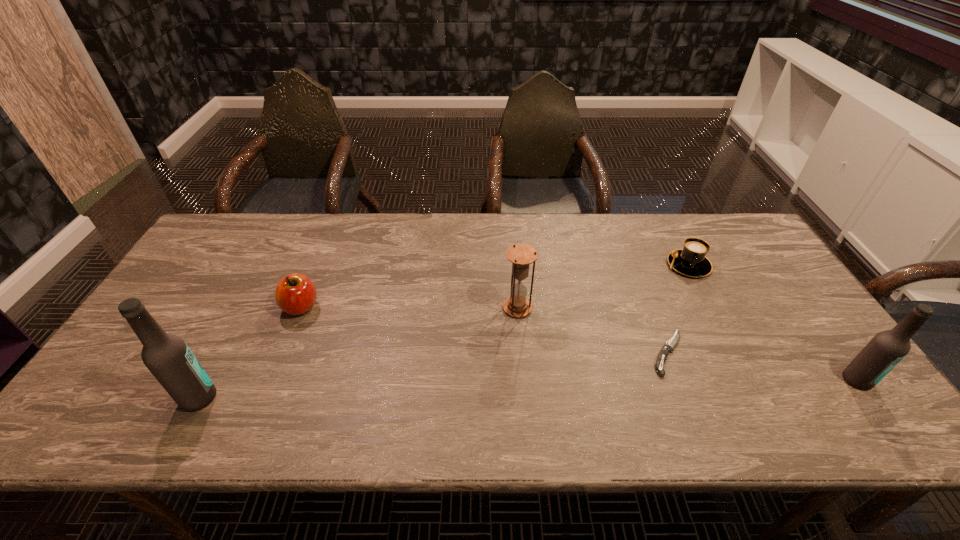
Find the location of a particular element. The width and height of the screenshot is (960, 540). the third object from right to left is located at coordinates (670, 344).

Where is `the shortest object`? the shortest object is located at coordinates (670, 344).

Locate an element on the screen. Image resolution: width=960 pixels, height=540 pixels. free region located 0.190m on the label of the taller beer bottle is located at coordinates (299, 397).

Identify the location of vacant region located 0.110m on the left of the farthest object. (631, 265).

Where is `blank area located 0.090m on the front of the fourth shortest object`? The height and width of the screenshot is (540, 960). blank area located 0.090m on the front of the fourth shortest object is located at coordinates (520, 346).

Locate an element on the screen. The image size is (960, 540). vacant space located on the left of the apple is located at coordinates (228, 307).

Where is `free space located 0.070m on the right of the shortest object`? This screenshot has width=960, height=540. free space located 0.070m on the right of the shortest object is located at coordinates (714, 353).

The image size is (960, 540). Find the location of `object present at the far edge`. object present at the far edge is located at coordinates (691, 261).

Identify the location of pocketknife that is positioned at the near edge. (670, 344).

Where is `object located at the right edge`? This screenshot has height=540, width=960. object located at the right edge is located at coordinates [x=886, y=349].